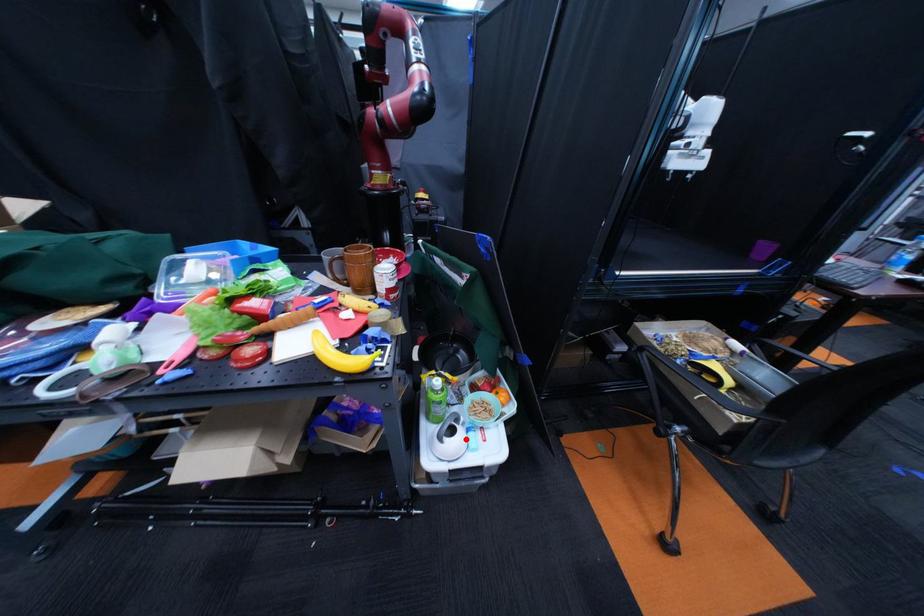
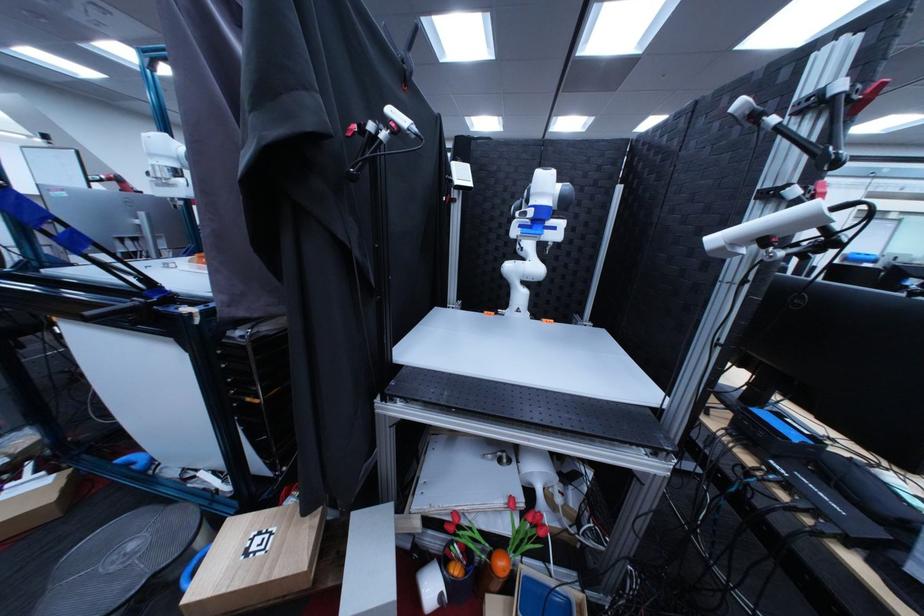
Question: I am providing you with two images of the same scene from different viewpoints. A red point is marked on the first image. At the location where the point appears in image 1, is it still visible in image 2?

Choices:
 (A) Yes
 (B) No

Answer: (B)